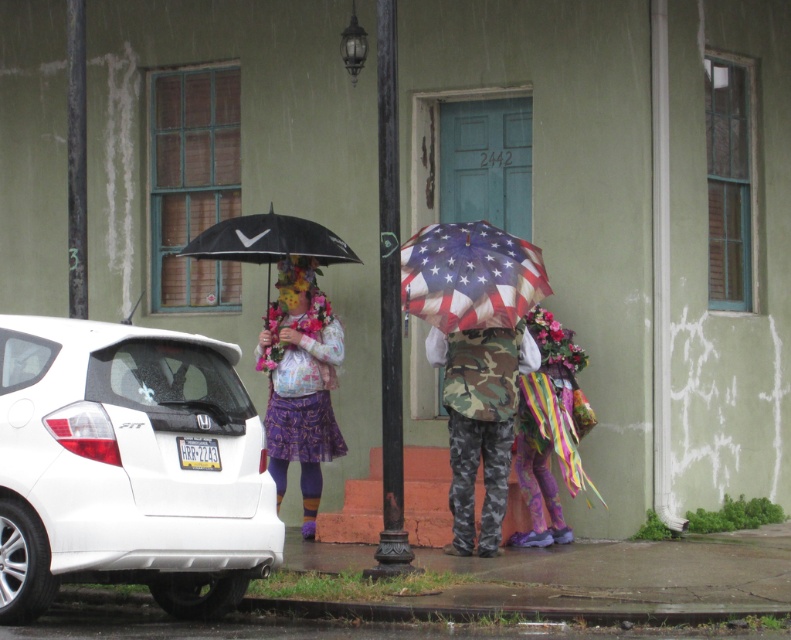
Between camouflage-patterned pants at center and american flag print umbrella at center, which one is positioned higher?

Positioned higher is american flag print umbrella at center.

Who is more distant from viewer, (294, 317) or (456, 253)?

The point (294, 317) is behind.

At what (x,y) coordinates should I click in order to perform the action: click on camouflage-patterned pants at center. Please return your answer as a coordinate pair (x, y). This screenshot has height=640, width=791. Looking at the image, I should click on (301, 388).

What do you see at coordinates (267, 241) in the screenshot? This screenshot has width=791, height=640. I see `black matte umbrella at left` at bounding box center [267, 241].

Is point (350, 250) less distant than point (271, 410)?

No, it is not.

At what (x,y) coordinates should I click in order to perform the action: click on black matte umbrella at left. Please return your answer as a coordinate pair (x, y). Looking at the image, I should click on (267, 241).

Does white matte car at left have a larger size compared to american flag print umbrella at center?

Yes, white matte car at left is bigger than american flag print umbrella at center.

Is point (186, 412) farther from camera compared to point (445, 316)?

No.

Who is more forward, (199,522) or (485,256)?

Positioned in front is point (199,522).

This screenshot has width=791, height=640. I want to click on white matte car at left, so (x=127, y=467).